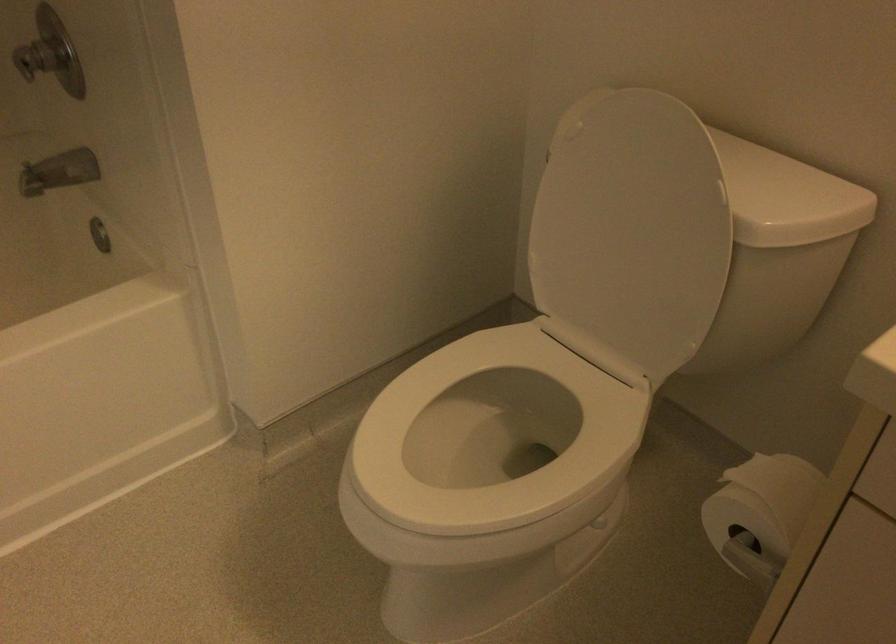
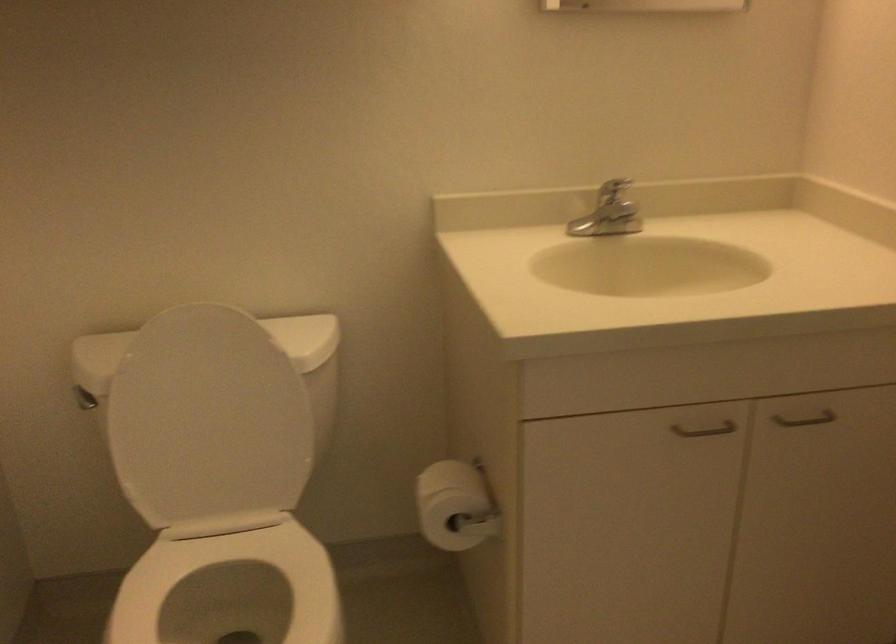
Question: The images are taken continuously from a first-person perspective. In which direction is your viewpoint rotating?

Choices:
 (A) Left
 (B) Right
 (C) Up
 (D) Down

Answer: (B)